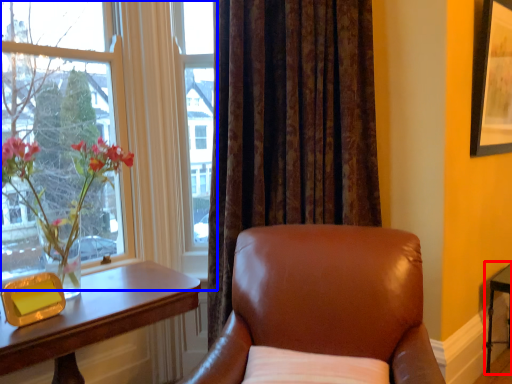
Question: Which point is further to the camera, side table (highlighted by a red box) or window (highlighted by a blue box)?

Choices:
 (A) side table
 (B) window

Answer: (A)